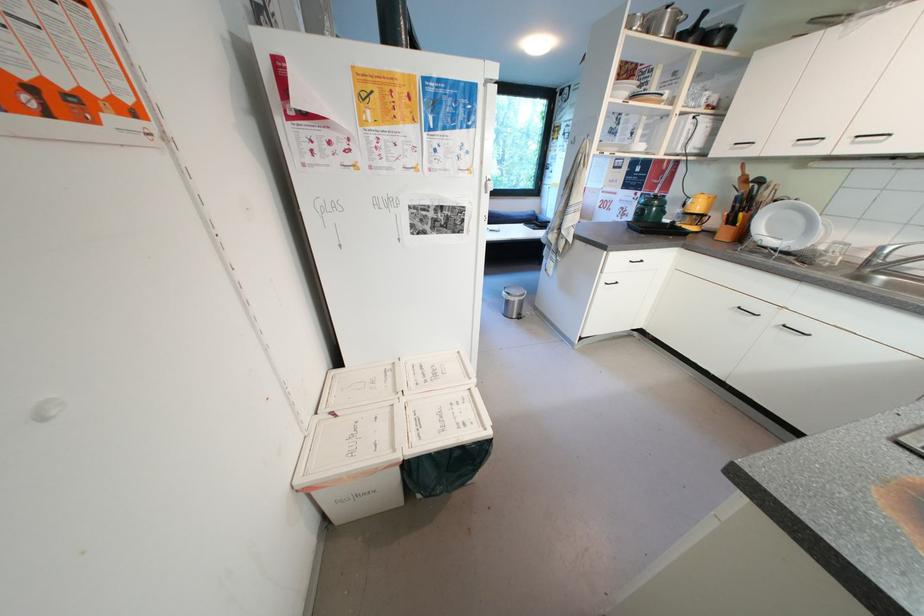
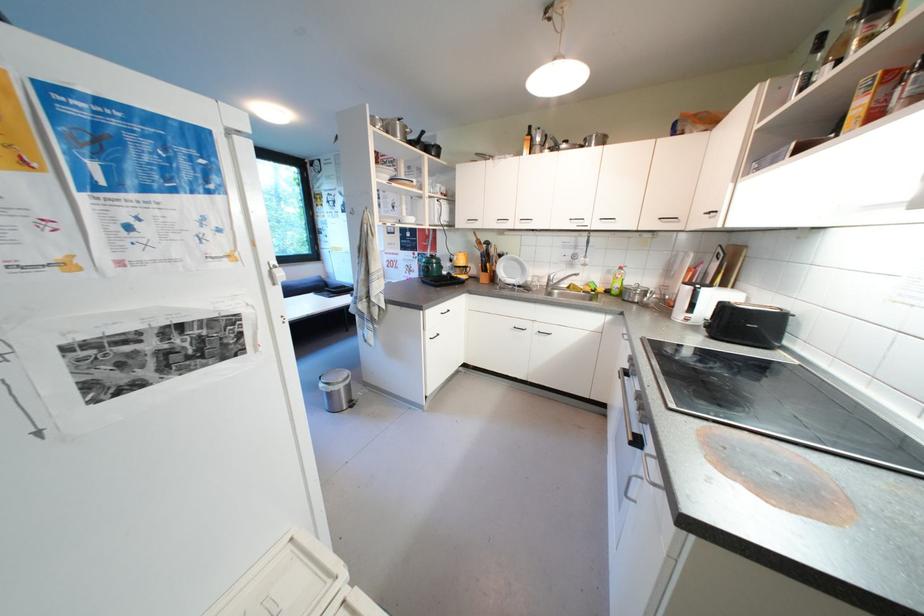
Question: Based on the continuous images, in which direction is the camera rotating? Reply with the corresponding letter.

Choices:
 (A) Left
 (B) Right
 (C) Up
 (D) Down

Answer: (B)